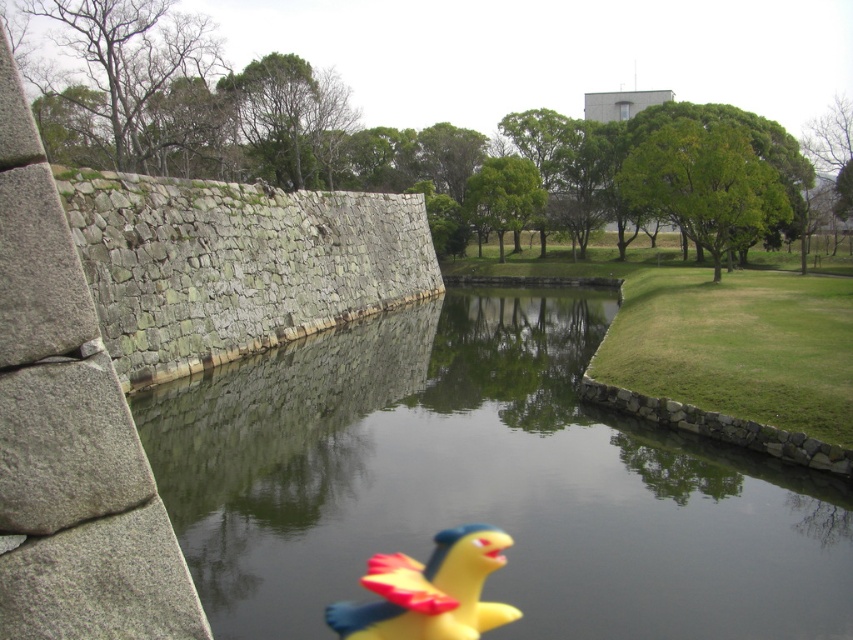
You are standing at the origin point in the image. Which direction should you move to reach the clear glass water at center?

The clear glass water at center is located at point 0.755 on the x axis and 0.567 on the y axis. Since you are at the origin point, you should move towards the right and slightly upwards to reach it.

You are a photographer trying to capture the reflection of the yellow rubber duck at center in the clear glass water at center. Based on the scene description, will the duck be fully visible in the reflection?

The clear glass water at center has a larger size compared to yellow rubber duck at center, so the duck should be fully visible in its reflection since the water surface is bigger than the duck.